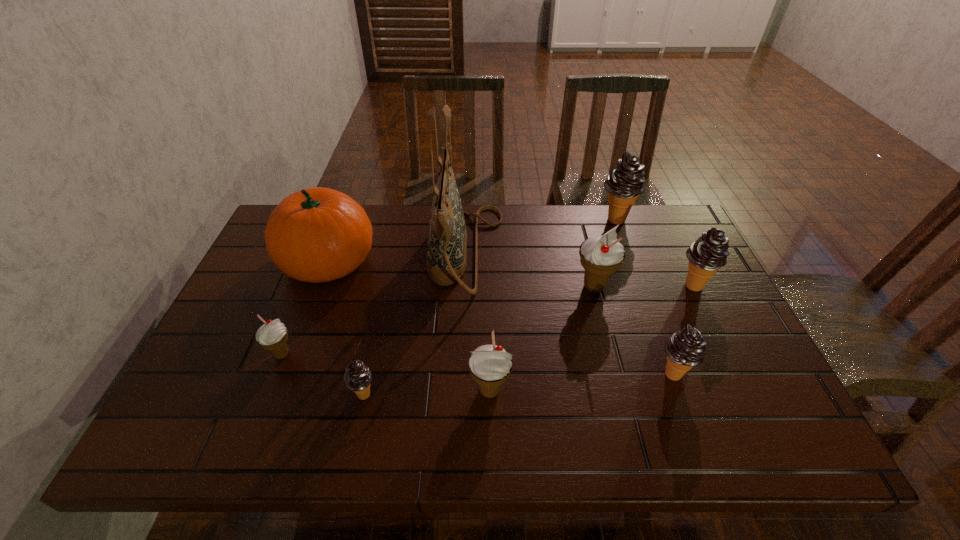
Find the location of `the fifth icecream from right to left`. the fifth icecream from right to left is located at coordinates (490, 366).

You are a GUI agent. You are given a task and a screenshot of the screen. Output one action in this format:
    pyautogui.click(x=<x>, y=<y>)
    Task: Click on the smallest white icecream
    This screenshot has height=540, width=960.
    Given the screenshot: What is the action you would take?
    pyautogui.click(x=273, y=335)

This screenshot has height=540, width=960. I want to click on the second farthest white icecream, so click(x=273, y=335).

Find the location of a particular element. The height and width of the screenshot is (540, 960). the sixth icecream from right to left is located at coordinates (357, 378).

Image resolution: width=960 pixels, height=540 pixels. Find the location of `the leftmost chocolate icecream`. the leftmost chocolate icecream is located at coordinates (357, 378).

The image size is (960, 540). What are the coordinates of `vacant space located on the front-facing side of the tallest object` in the screenshot? It's located at (564, 253).

At what (x,y) coordinates should I click in order to perform the action: click on vacant space located on the front of the tallest icecream. Please return your answer as a coordinate pair (x, y). The width and height of the screenshot is (960, 540). Looking at the image, I should click on (655, 324).

Where is `blank space located on the right of the pumpkin`? blank space located on the right of the pumpkin is located at coordinates (498, 261).

The width and height of the screenshot is (960, 540). Find the location of `free location located on the back of the rightmost icecream`. free location located on the back of the rightmost icecream is located at coordinates (675, 248).

Where is `vacant region located 0.110m on the front of the fourth icecream from right to left`? vacant region located 0.110m on the front of the fourth icecream from right to left is located at coordinates (606, 334).